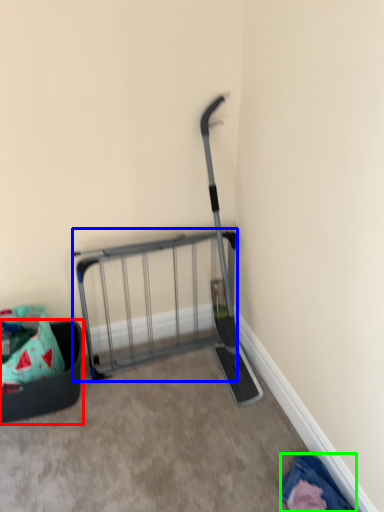
Question: Estimate the real-world distances between objects in this image. Which object is farther from furniture (highlighted by a red box), cart (highlighted by a blue box) or clothing (highlighted by a green box)?

Choices:
 (A) cart
 (B) clothing

Answer: (B)